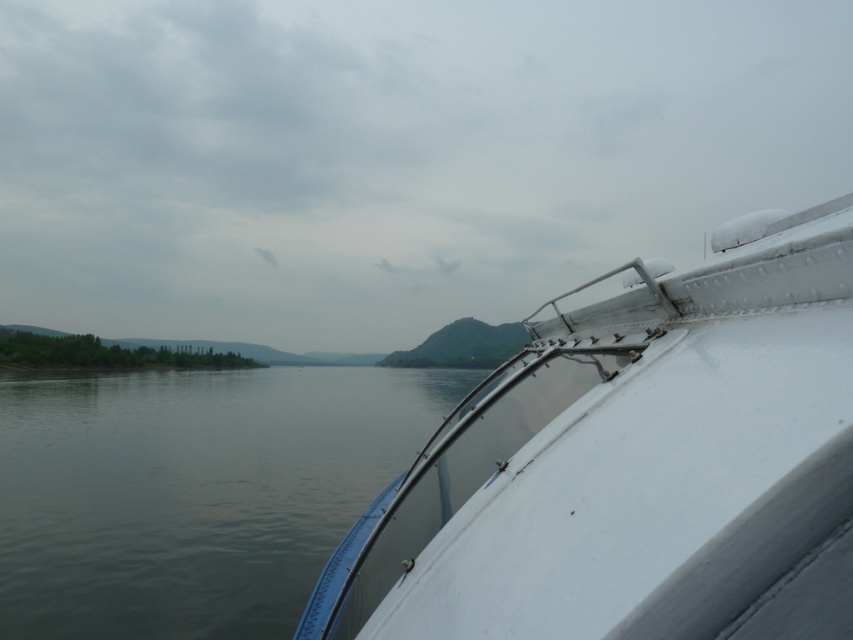
From the picture: Who is lower down, white matte boat at right or gray water at center?

Positioned lower is gray water at center.

Is white matte boat at right taller than gray water at center?

In fact, white matte boat at right may be shorter than gray water at center.

Identify the location of white matte boat at right. This screenshot has height=640, width=853. (635, 465).

The width and height of the screenshot is (853, 640). What do you see at coordinates (390, 156) in the screenshot?
I see `matte white sky at upper center` at bounding box center [390, 156].

Between point (775, 161) and point (341, 448), which one is positioned behind?

The point (775, 161) is behind.

Who is more forward, (x=590, y=243) or (x=193, y=604)?

Point (x=193, y=604)

Where is `matte white sky at upper center`? matte white sky at upper center is located at coordinates (390, 156).

Is point (482, 54) positioned behind point (589, 595)?

Yes, point (482, 54) is behind point (589, 595).

Is matte white sky at upper center behind white matte boat at right?

Yes, matte white sky at upper center is further from the viewer.

Where is `matte white sky at upper center`? matte white sky at upper center is located at coordinates (390, 156).